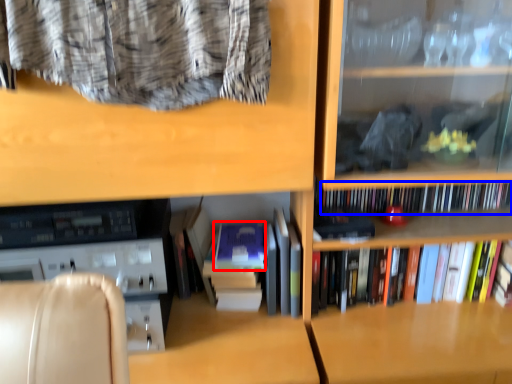
Question: Among these objects, which one is nearest to the camera, paperback book (highlighted by a red box) or book (highlighted by a blue box)?

Choices:
 (A) paperback book
 (B) book

Answer: (A)